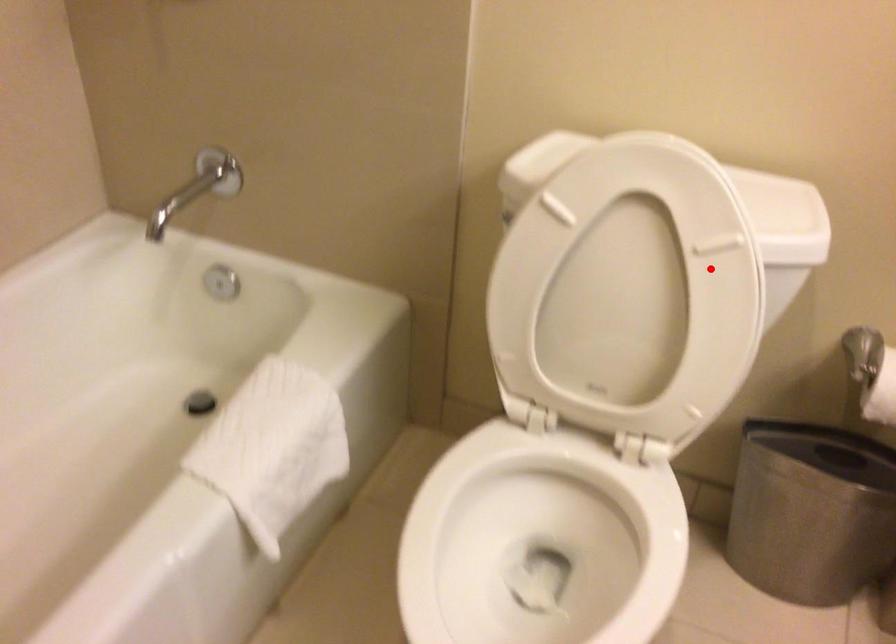
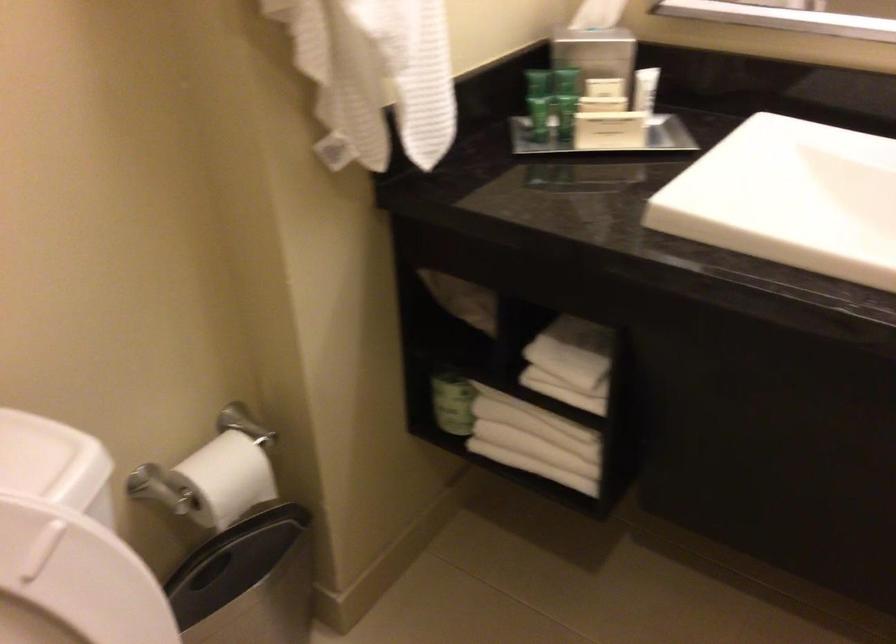
Locate, in the second image, the point that corresponds to the highlighted location in the first image.

(73, 582)